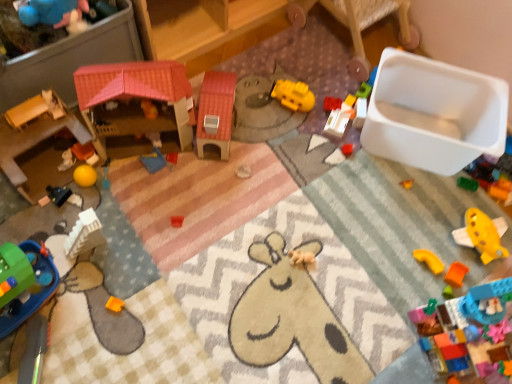
Locate an element on the screen. Image resolution: width=512 pixels, height=384 pixels. free area in between plastic pink house at center, positioned as the 9th toy in right-to-left order, and blue plastic tray at center, acting as the 6th toy starting from the left is located at coordinates (161, 173).